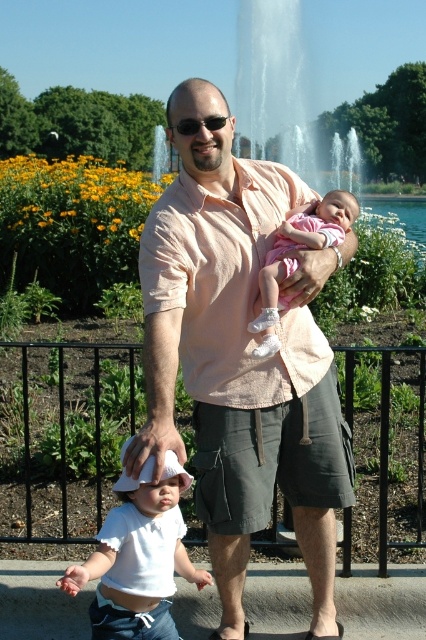
From the picture: Can you confirm if pink cotton shirt at center is positioned to the right of white cotton shirt at lower left?

Correct, you'll find pink cotton shirt at center to the right of white cotton shirt at lower left.

Is pink cotton shirt at center wider than white cotton shirt at lower left?

Indeed, pink cotton shirt at center has a greater width compared to white cotton shirt at lower left.

Is point (241, 618) positioned after point (150, 534)?

Yes, point (241, 618) is farther from viewer.

Where is `pink cotton shirt at center`? The image size is (426, 640). pink cotton shirt at center is located at coordinates (241, 365).

In the scene shown: Between white cotton shirt at lower left and sunglasses at center, which one appears on the right side from the viewer's perspective?

sunglasses at center is more to the right.

Between white cotton shirt at lower left and sunglasses at center, which one appears on the left side from the viewer's perspective?

Positioned to the left is white cotton shirt at lower left.

Where is `white cotton shirt at lower left`? white cotton shirt at lower left is located at coordinates (138, 557).

Where is `white cotton shirt at lower left`? This screenshot has width=426, height=640. white cotton shirt at lower left is located at coordinates (138, 557).

Does point (287, 432) lie behind point (192, 120)?

Yes, point (287, 432) is farther from viewer.

Find the location of a particular element. The image size is (426, 640). pink cotton shirt at center is located at coordinates (241, 365).

Where is `pink cotton shirt at center`? The image size is (426, 640). pink cotton shirt at center is located at coordinates (241, 365).